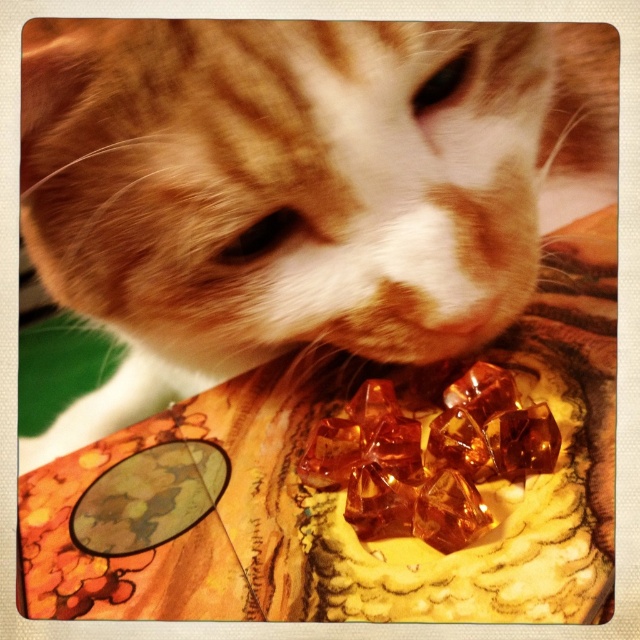
Question: Does orange fur cat at center appear on the left side of translucent amber cubes at center?

Choices:
 (A) yes
 (B) no

Answer: (A)

Question: Can you confirm if orange fur cat at center is positioned to the right of translucent amber cubes at center?

Choices:
 (A) no
 (B) yes

Answer: (A)

Question: Which object appears farthest from the camera in this image?

Choices:
 (A) orange fur cat at center
 (B) translucent amber cubes at center

Answer: (B)

Question: Among these points, which one is nearest to the camera?

Choices:
 (A) (67, 196)
 (B) (307, 460)

Answer: (A)

Question: Does orange fur cat at center have a larger size compared to translucent amber cubes at center?

Choices:
 (A) no
 (B) yes

Answer: (B)